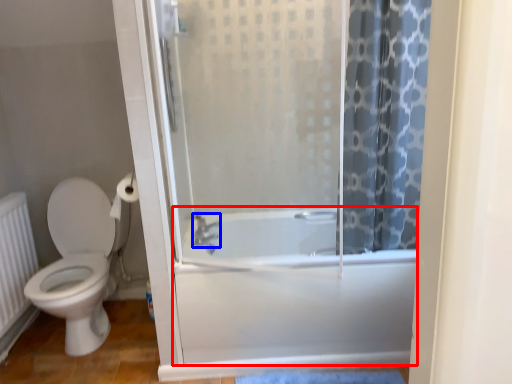
Question: Which of the following is the closest to the observer, bath (highlighted by a red box) or shower (highlighted by a blue box)?

Choices:
 (A) bath
 (B) shower

Answer: (A)